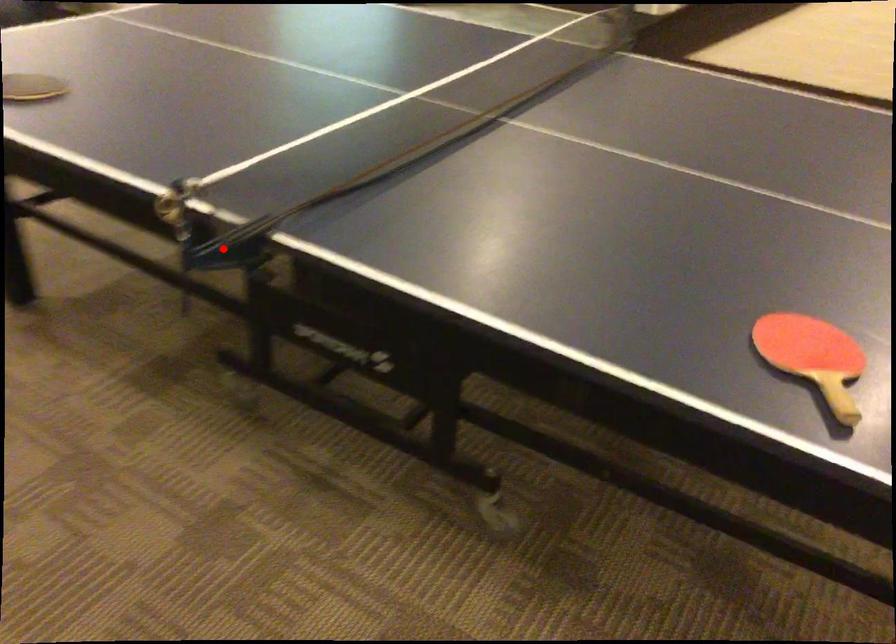
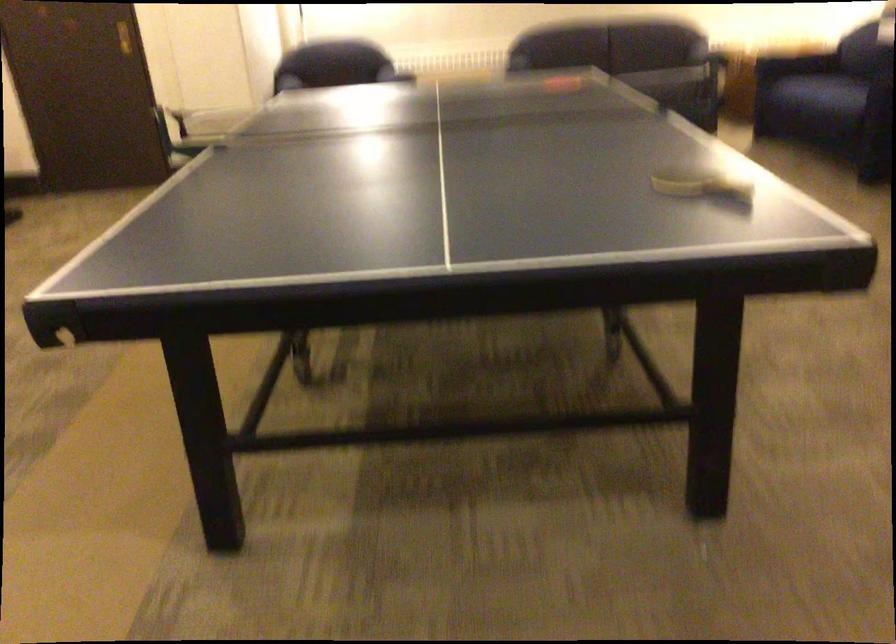
Question: I am providing you with two images of the same scene from different viewpoints. A red point is shown in image1. For the corresponding object point in image2, is it positioned nearer or farther from the camera?

Choices:
 (A) Nearer
 (B) Farther

Answer: (B)